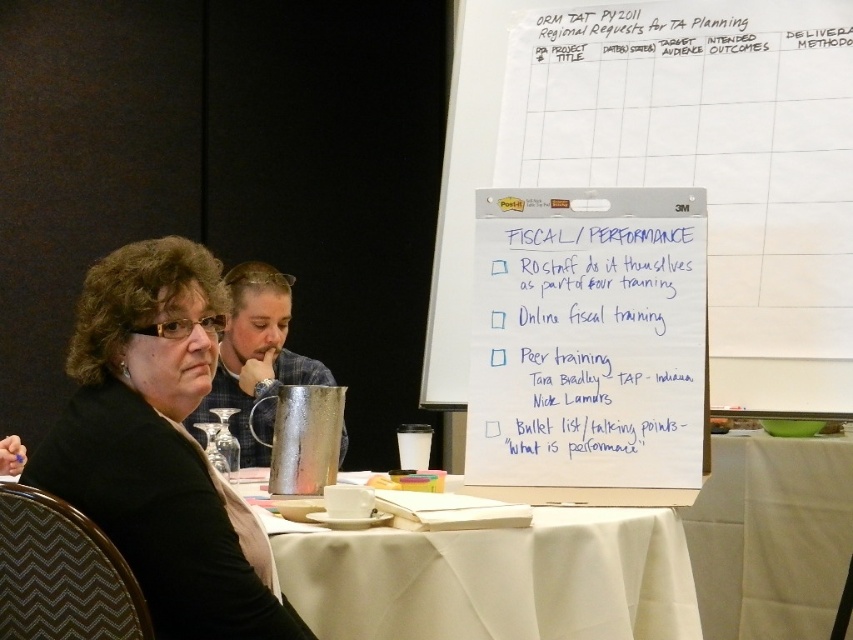
You are organizing a small event and need to place a new decorative item on the table. The table has limited space. Given the current arrangement with the black fabric jacket at left and the brushed metal pitcher at center, which object should you move to accommodate the new item?

You should move the black fabric jacket at left because it occupies less space than the brushed metal pitcher at center, making it easier to relocate to free up more space for the new item.

Consider the image. You are organizing a meeting and need to place a presentation board on the white paperboard at upper right and a tablecloth on the white cloth at lower right. According to the scene, which object is closer to you when standing at the table?

The white paperboard at upper right is closer to you because it is in front of the white cloth at lower right.